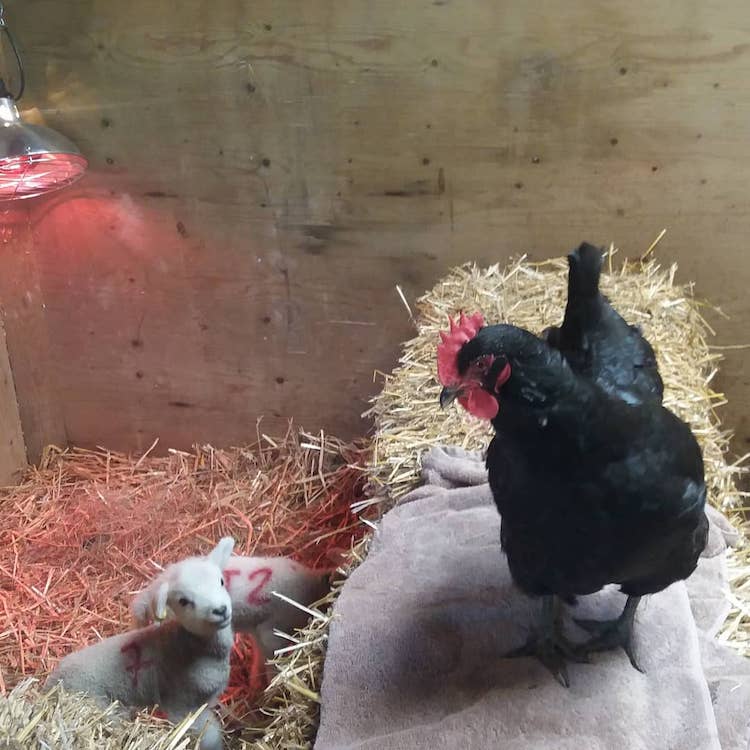
The image size is (750, 750). I want to click on heat lamp, so click(64, 164).